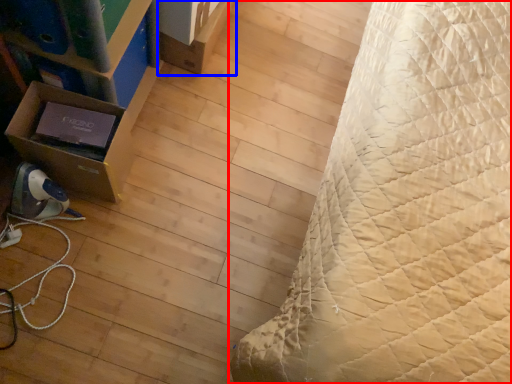
Question: Which point is closer to the camera, bed (highlighted by a red box) or cardboard box (highlighted by a blue box)?

Choices:
 (A) bed
 (B) cardboard box

Answer: (A)